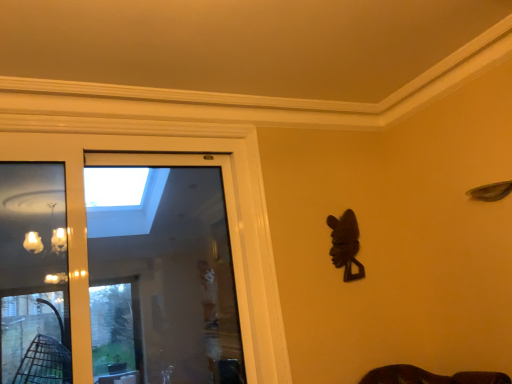
Measure the distance between dark brown wood mask at right and camera.

dark brown wood mask at right is 2.58 meters away from camera.

You are a GUI agent. You are given a task and a screenshot of the screen. Output one action in this format:
    pyautogui.click(x=<x>, y=<y>)
    Task: Click on the dark brown wood mask at right
    The width and height of the screenshot is (512, 384).
    Given the screenshot: What is the action you would take?
    pyautogui.click(x=345, y=244)

Describe the element at coordinates (345, 244) in the screenshot. The width and height of the screenshot is (512, 384). I see `dark brown wood mask at right` at that location.

This screenshot has width=512, height=384. Describe the element at coordinates (164, 265) in the screenshot. I see `transparent glass screen door at center` at that location.

The height and width of the screenshot is (384, 512). I want to click on transparent glass screen door at center, so click(x=164, y=265).

Find the location of a particular element. Image resolution: width=512 pixels, height=384 pixels. dark brown wood mask at right is located at coordinates [x=345, y=244].

Considering the relative positions of dark brown wood mask at right and transparent glass screen door at center in the image provided, is dark brown wood mask at right to the left or to the right of transparent glass screen door at center?

dark brown wood mask at right is positioned on transparent glass screen door at center's right side.

Is the position of dark brown wood mask at right less distant than that of transparent glass screen door at center?

No, dark brown wood mask at right is further to the viewer.

Does point (345, 228) lie in front of point (239, 260)?

No, (345, 228) is behind (239, 260).

Based on the photo, from the image's perspective, who appears lower, dark brown wood mask at right or transparent glass screen door at center?

From the image's view, transparent glass screen door at center is below.

From a real-world perspective, which is physically below, dark brown wood mask at right or transparent glass screen door at center?

transparent glass screen door at center is physically lower.

From the picture: Considering the sizes of objects dark brown wood mask at right and transparent glass screen door at center in the image provided, who is thinner, dark brown wood mask at right or transparent glass screen door at center?

Thinner between the two is dark brown wood mask at right.

Between dark brown wood mask at right and transparent glass screen door at center, which one has less height?

Standing shorter between the two is dark brown wood mask at right.

Who is bigger, dark brown wood mask at right or transparent glass screen door at center?

transparent glass screen door at center is bigger.

Which is correct: dark brown wood mask at right is inside transparent glass screen door at center, or outside of it?

dark brown wood mask at right is not inside transparent glass screen door at center, it's outside.

Would you consider dark brown wood mask at right to be distant from transparent glass screen door at center?

Yes, dark brown wood mask at right and transparent glass screen door at center are quite far apart.

Is dark brown wood mask at right facing towards transparent glass screen door at center?

No, dark brown wood mask at right is not aimed at transparent glass screen door at center.

At what (x,y) coordinates should I click in order to perform the action: click on screen door in front of the dark brown wood mask at right. Please return your answer as a coordinate pair (x, y). Image resolution: width=512 pixels, height=384 pixels. Looking at the image, I should click on (164, 265).

Can you confirm if transparent glass screen door at center is positioned to the left of dark brown wood mask at right?

Yes, transparent glass screen door at center is to the left of dark brown wood mask at right.

Is transparent glass screen door at center closer to camera compared to dark brown wood mask at right?

Yes, it is.

Between point (192, 334) and point (345, 218), which one is positioned behind?

Point (192, 334)

From the image's perspective, between transparent glass screen door at center and dark brown wood mask at right, who is located below?

transparent glass screen door at center, from the image's perspective.

From a real-world perspective, between transparent glass screen door at center and dark brown wood mask at right, who is vertically higher?

dark brown wood mask at right is physically above.

Does transparent glass screen door at center have a lesser width compared to dark brown wood mask at right?

In fact, transparent glass screen door at center might be wider than dark brown wood mask at right.

Who is taller, transparent glass screen door at center or dark brown wood mask at right?

transparent glass screen door at center.

Looking at the image, does transparent glass screen door at center seem bigger or smaller compared to dark brown wood mask at right?

Considering their sizes, transparent glass screen door at center takes up more space than dark brown wood mask at right.

Is transparent glass screen door at center located outside dark brown wood mask at right?

Indeed, transparent glass screen door at center is completely outside dark brown wood mask at right.

Is transparent glass screen door at center not near dark brown wood mask at right?

Indeed, transparent glass screen door at center is not near dark brown wood mask at right.

Could you tell me if transparent glass screen door at center is turned towards dark brown wood mask at right?

No, transparent glass screen door at center is not facing towards dark brown wood mask at right.

Identify the location of screen door beneath the dark brown wood mask at right (from a real-world perspective). The height and width of the screenshot is (384, 512). (164, 265).

I want to click on screen door below the dark brown wood mask at right (from the image's perspective), so click(164, 265).

This screenshot has height=384, width=512. I want to click on animal that is on the right side of transparent glass screen door at center, so click(345, 244).